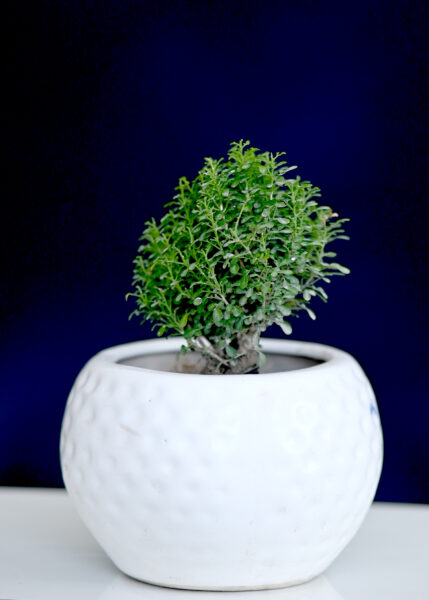
The height and width of the screenshot is (600, 429). What are the coordinates of `plant` in the screenshot? It's located at (263, 224).